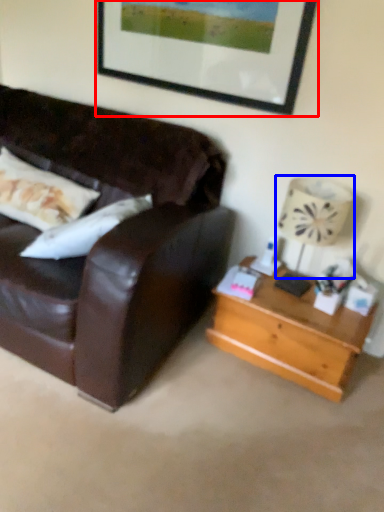
Question: Which point is closer to the camera, picture frame (highlighted by a red box) or lamp (highlighted by a blue box)?

Choices:
 (A) picture frame
 (B) lamp

Answer: (B)